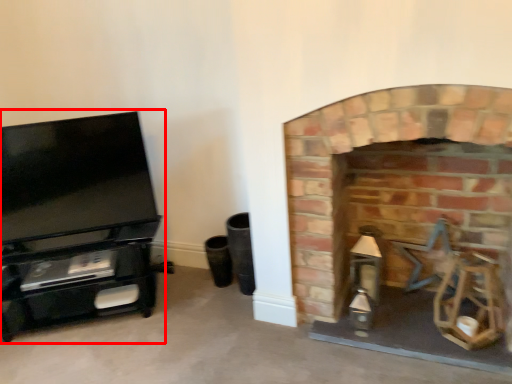
Question: From the image's perspective, considering the relative positions of entertainment center (annotated by the red box) and fireplace in the image provided, where is entertainment center (annotated by the red box) located with respect to the staircase?

Choices:
 (A) below
 (B) above

Answer: (B)